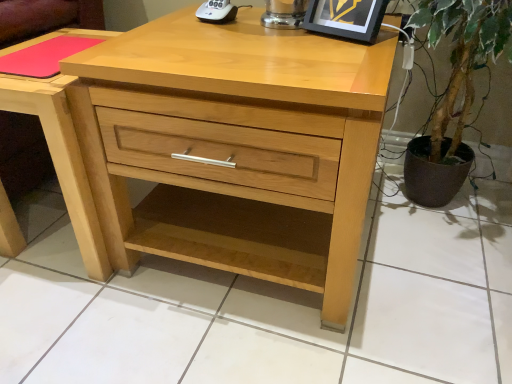
Question: In which direction should I rotate to look at white plastic remote control at upper center?

Choices:
 (A) left
 (B) right

Answer: (A)

Question: Should I look upward or downward to see pink matte mousepad at upper left?

Choices:
 (A) down
 (B) up

Answer: (B)

Question: Is pink matte mousepad at upper left in contact with white plastic remote control at upper center?

Choices:
 (A) yes
 (B) no

Answer: (B)

Question: From the image's perspective, is pink matte mousepad at upper left on white plastic remote control at upper center?

Choices:
 (A) yes
 (B) no

Answer: (B)

Question: From the image's perspective, is pink matte mousepad at upper left beneath white plastic remote control at upper center?

Choices:
 (A) yes
 (B) no

Answer: (A)

Question: Could you tell me if pink matte mousepad at upper left is turned towards white plastic remote control at upper center?

Choices:
 (A) yes
 (B) no

Answer: (B)

Question: Is pink matte mousepad at upper left not near white plastic remote control at upper center?

Choices:
 (A) no
 (B) yes

Answer: (A)

Question: Is pink matte mousepad at upper left completely or partially outside of white plastic remote control at upper center?

Choices:
 (A) yes
 (B) no

Answer: (A)

Question: Considering the relative sizes of pink matte mousepad at upper left and natural wood chest of drawers at center in the image provided, is pink matte mousepad at upper left shorter than natural wood chest of drawers at center?

Choices:
 (A) yes
 (B) no

Answer: (A)

Question: Does pink matte mousepad at upper left turn towards natural wood chest of drawers at center?

Choices:
 (A) no
 (B) yes

Answer: (A)

Question: From the image's perspective, would you say pink matte mousepad at upper left is shown under natural wood chest of drawers at center?

Choices:
 (A) no
 (B) yes

Answer: (A)

Question: Does pink matte mousepad at upper left appear on the right side of natural wood chest of drawers at center?

Choices:
 (A) yes
 (B) no

Answer: (B)

Question: Is pink matte mousepad at upper left closer to camera compared to natural wood chest of drawers at center?

Choices:
 (A) yes
 (B) no

Answer: (B)

Question: Does pink matte mousepad at upper left appear on the left side of natural wood chest of drawers at center?

Choices:
 (A) no
 (B) yes

Answer: (B)

Question: Can you confirm if pink matte mousepad at upper left is smaller than matte black picture frame at upper right?

Choices:
 (A) no
 (B) yes

Answer: (B)